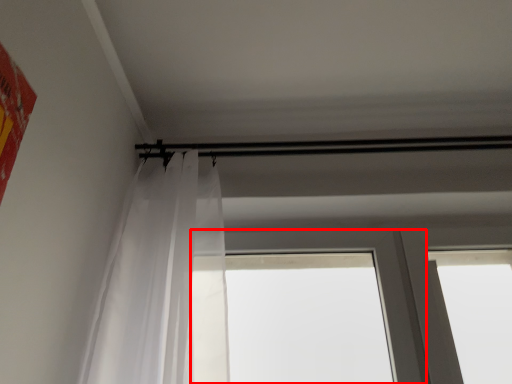
Question: From the image's perspective, where is window (annotated by the red box) located in relation to curtain in the image?

Choices:
 (A) below
 (B) above

Answer: (A)